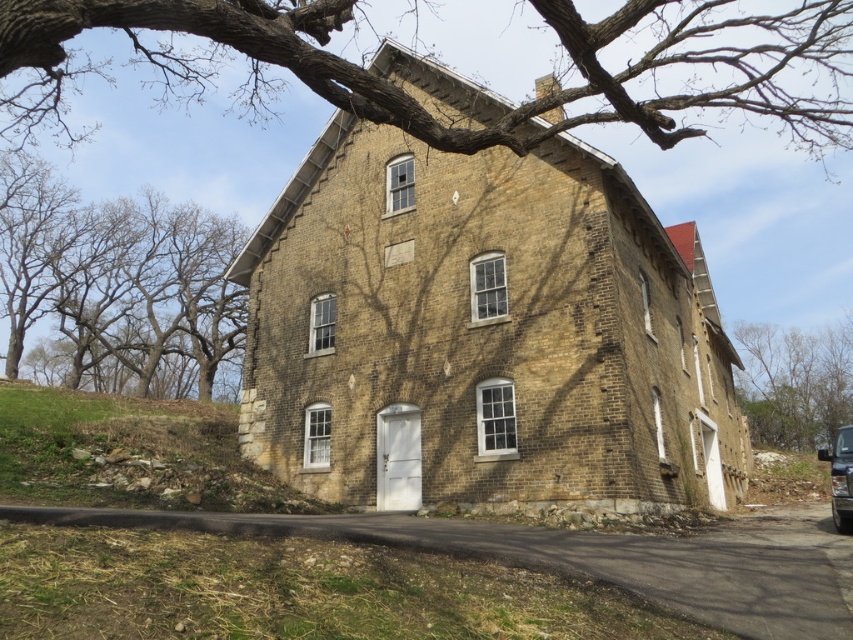
Is bare branches at left below bare branches at right?

Incorrect, bare branches at left is not positioned below bare branches at right.

Image resolution: width=853 pixels, height=640 pixels. What are the coordinates of `bare branches at left` in the screenshot? It's located at coord(117,285).

Which is behind, point (68, 353) or point (810, 337)?

Point (810, 337)

You are a GUI agent. You are given a task and a screenshot of the screen. Output one action in this format:
    pyautogui.click(x=<x>, y=<y>)
    Task: Click on the bare branches at left
    
    Given the screenshot: What is the action you would take?
    pyautogui.click(x=117, y=285)

Is brown bark tree at upper center to the left of metallic silver car at lower right from the viewer's perspective?

Correct, you'll find brown bark tree at upper center to the left of metallic silver car at lower right.

This screenshot has height=640, width=853. Identify the location of brown bark tree at upper center. (508, 108).

Does brown bark tree at upper center appear on the right side of bare branches at left?

Indeed, brown bark tree at upper center is positioned on the right side of bare branches at left.

Is brown bark tree at upper center below bare branches at left?

Actually, brown bark tree at upper center is above bare branches at left.

Is point (820, 67) positioned behind point (200, 326)?

Yes, point (820, 67) is behind point (200, 326).

The width and height of the screenshot is (853, 640). In order to click on brown bark tree at upper center in this screenshot , I will do point(508,108).